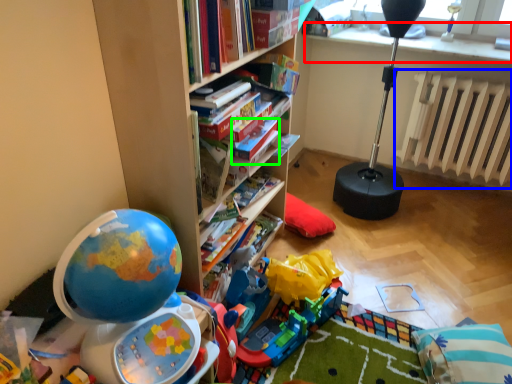
Question: Based on their relative distances, which object is farther from window sill (highlighted by a red box)? Choose from radiator (highlighted by a blue box) and paperback book (highlighted by a green box).

Choices:
 (A) radiator
 (B) paperback book

Answer: (B)